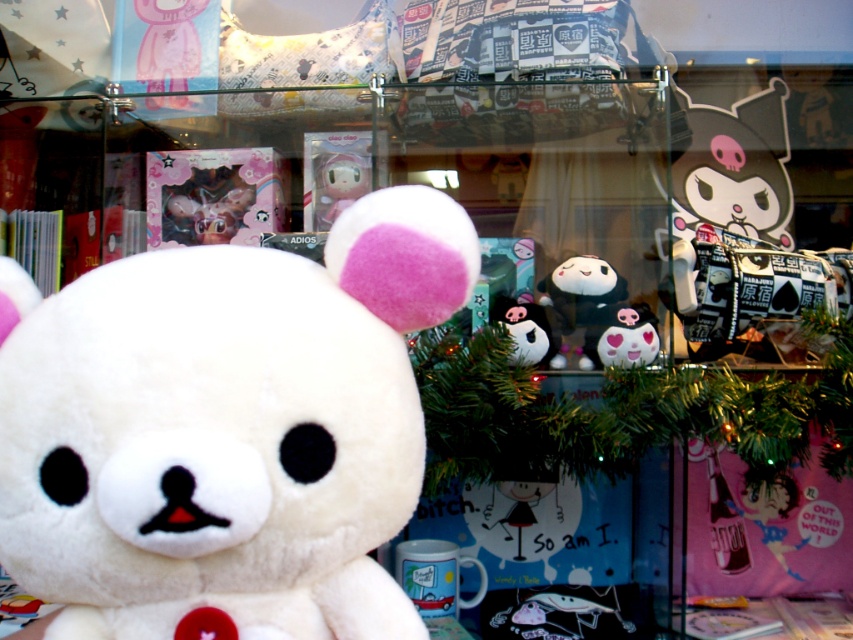
You are standing in front of the store window and want to touch the point at coordinates point (148, 72). If your hand can reach up to 1.3 meters, will you be able to touch it?

The distance of point (148, 72) from camera is 1.28 meters, so yes, you can touch it since it is within your reach of 1.3 meters.

You are a customer looking at the store window display. You want to see the black plush toy at center clearly. Is it possible to see it without moving the matte pink plush bear at upper left?

The black plush toy at center is behind the matte pink plush bear at upper left, so it might be partially or fully blocked from view unless the bear is moved.

You are a store employee arranging the display. You need to place a new rectangular box that is 10 cm wide between the matte pink plush bear at upper left and the black plush toy at center. Based on their widths, can the box fit between them without overlapping?

The matte pink plush bear at upper left is wider than the black plush toy at center. Since the box is 10 cm wide, it can fit between them as long as the total available space between the two objects is at least 10 cm. However, the exact placement depends on their actual spacing, which isn